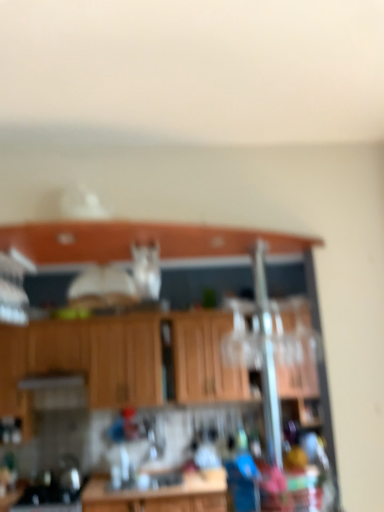
Describe the element at coordinates (138, 241) in the screenshot. This screenshot has height=512, width=384. I see `wooden cabinet at upper center` at that location.

The width and height of the screenshot is (384, 512). I want to click on wooden cabinet at upper center, so click(x=138, y=241).

Locate an element on the screen. wooden cabinets at center is located at coordinates (124, 358).

The width and height of the screenshot is (384, 512). What do you see at coordinates (124, 358) in the screenshot?
I see `wooden cabinets at center` at bounding box center [124, 358].

What are the coordinates of `wooden cabinet at upper center` in the screenshot? It's located at (138, 241).

Considering the relative positions of wooden cabinets at center and wooden cabinet at upper center in the image provided, is wooden cabinets at center to the left of wooden cabinet at upper center from the viewer's perspective?

Yes, wooden cabinets at center is to the left of wooden cabinet at upper center.

Who is more distant, wooden cabinets at center or wooden cabinet at upper center?

Positioned behind is wooden cabinets at center.

Which is closer, (160, 342) or (204, 240)?

Point (160, 342) appears to be farther away from the viewer than point (204, 240).

From the image's perspective, which is above, wooden cabinets at center or wooden cabinet at upper center?

wooden cabinet at upper center is shown above in the image.

From a real-world perspective, which object stands above the other?

wooden cabinet at upper center, from a real-world perspective.

Which object is wider, wooden cabinets at center or wooden cabinet at upper center?

Wider between the two is wooden cabinet at upper center.

Is wooden cabinets at center taller than wooden cabinet at upper center?

Yes, wooden cabinets at center is taller than wooden cabinet at upper center.

Who is bigger, wooden cabinets at center or wooden cabinet at upper center?

wooden cabinets at center is bigger.

Is wooden cabinet at upper center located within wooden cabinets at center?

No, wooden cabinets at center does not contain wooden cabinet at upper center.

Is wooden cabinets at center far away from wooden cabinet at upper center?

Yes, wooden cabinets at center and wooden cabinet at upper center are quite far apart.

Is wooden cabinets at center facing away from wooden cabinet at upper center?

No, wooden cabinets at center is not facing away from wooden cabinet at upper center.

Can you tell me how much wooden cabinets at center and wooden cabinet at upper center differ in facing direction?

There is a 0.63-degree angle between the facing directions of wooden cabinets at center and wooden cabinet at upper center.

Image resolution: width=384 pixels, height=512 pixels. I want to click on window sill lying in front of the wooden cabinets at center, so click(x=138, y=241).

Is wooden cabinet at upper center to the right of wooden cabinets at center from the viewer's perspective?

Indeed, wooden cabinet at upper center is positioned on the right side of wooden cabinets at center.

Between wooden cabinet at upper center and wooden cabinets at center, which one is positioned in front?

wooden cabinet at upper center is more forward.

Does point (161, 231) lie in front of point (230, 327)?

Yes, it is in front of point (230, 327).

From the image's perspective, relative to wooden cabinets at center, is wooden cabinet at upper center above or below?

Based on their image positions, wooden cabinet at upper center is located above wooden cabinets at center.

From a real-world perspective, between wooden cabinet at upper center and wooden cabinets at center, who is vertically lower?

From a 3D spatial view, wooden cabinets at center is below.

Considering the relative sizes of wooden cabinet at upper center and wooden cabinets at center in the image provided, is wooden cabinet at upper center wider than wooden cabinets at center?

Yes, wooden cabinet at upper center is wider than wooden cabinets at center.

In terms of height, does wooden cabinet at upper center look taller or shorter compared to wooden cabinets at center?

In the image, wooden cabinet at upper center appears to be shorter than wooden cabinets at center.

Who is bigger, wooden cabinet at upper center or wooden cabinets at center?

With larger size is wooden cabinets at center.

Is wooden cabinets at center a part of wooden cabinet at upper center?

No, wooden cabinets at center is located outside of wooden cabinet at upper center.

Is wooden cabinet at upper center not near wooden cabinets at center?

wooden cabinet at upper center is positioned a significant distance from wooden cabinets at center.

Based on the photo, does wooden cabinet at upper center turn towards wooden cabinets at center?

No, wooden cabinet at upper center does not turn towards wooden cabinets at center.

How different are the orientations of wooden cabinet at upper center and wooden cabinets at center in degrees?

0.63 degrees separate the facing orientations of wooden cabinet at upper center and wooden cabinets at center.

Where is `window sill on the right of wooden cabinets at center`? window sill on the right of wooden cabinets at center is located at coordinates (138, 241).

At what (x,y) coordinates should I click in order to perform the action: click on window sill to the right of wooden cabinets at center. Please return your answer as a coordinate pair (x, y). Looking at the image, I should click on (138, 241).

Where is `cabinetry below the wooden cabinet at upper center (from a real-world perspective)`? Image resolution: width=384 pixels, height=512 pixels. cabinetry below the wooden cabinet at upper center (from a real-world perspective) is located at coordinates (124, 358).